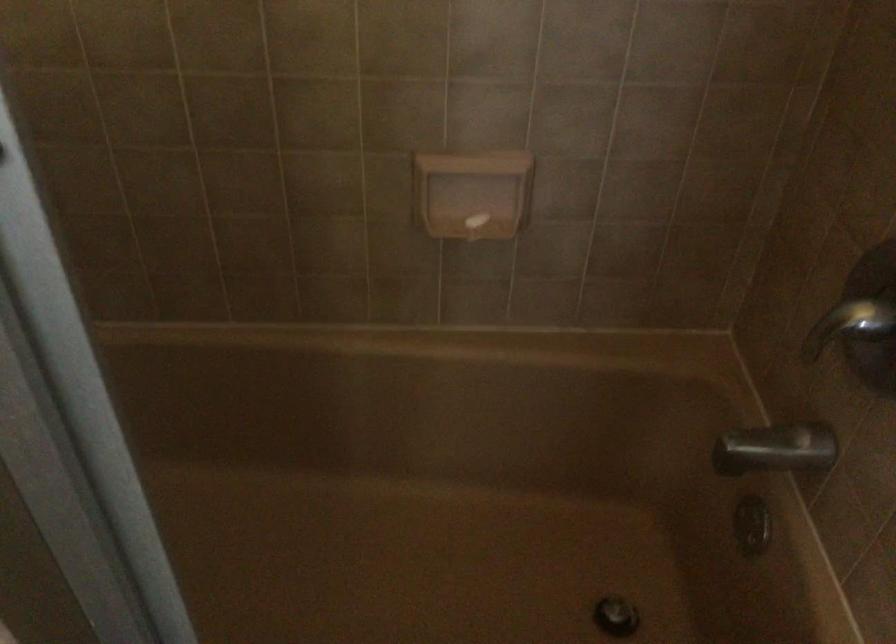
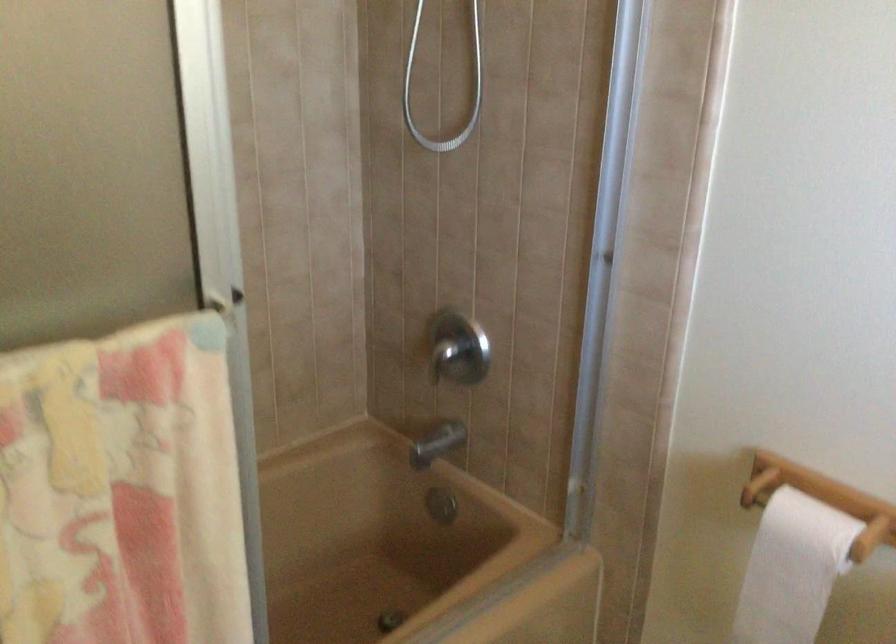
Where in the second image is the point corresponding to point 768,442 from the first image?

(436, 444)